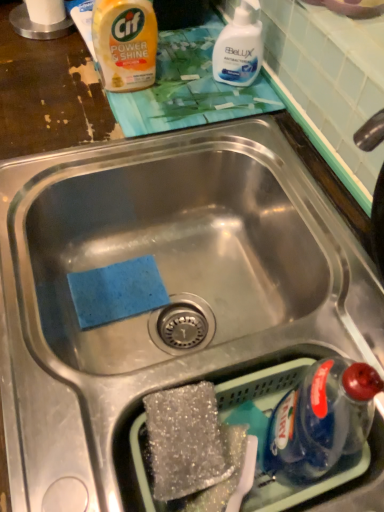
The image size is (384, 512). I want to click on vacant space that's between white glossy liquid at upper center and yellow plastic bottle at upper left, so click(x=181, y=84).